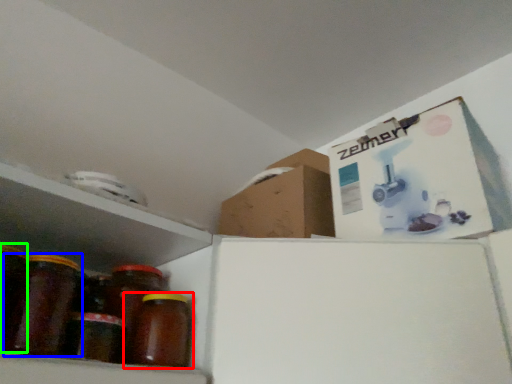
Question: Estimate the real-world distances between objects in this image. Which object is closer to bottle (highlighted by a red box), bottle (highlighted by a blue box) or glass jar (highlighted by a green box)?

Choices:
 (A) bottle
 (B) glass jar

Answer: (A)